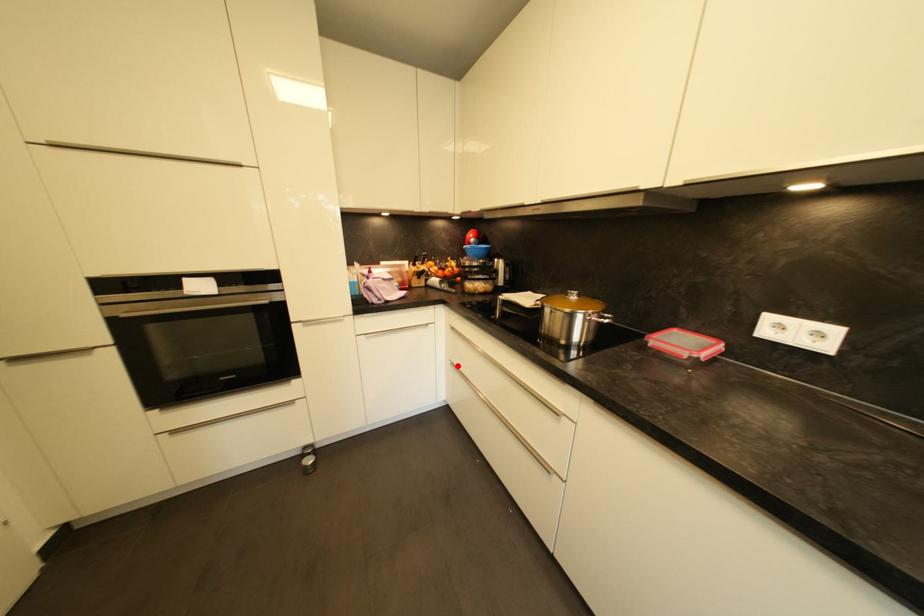
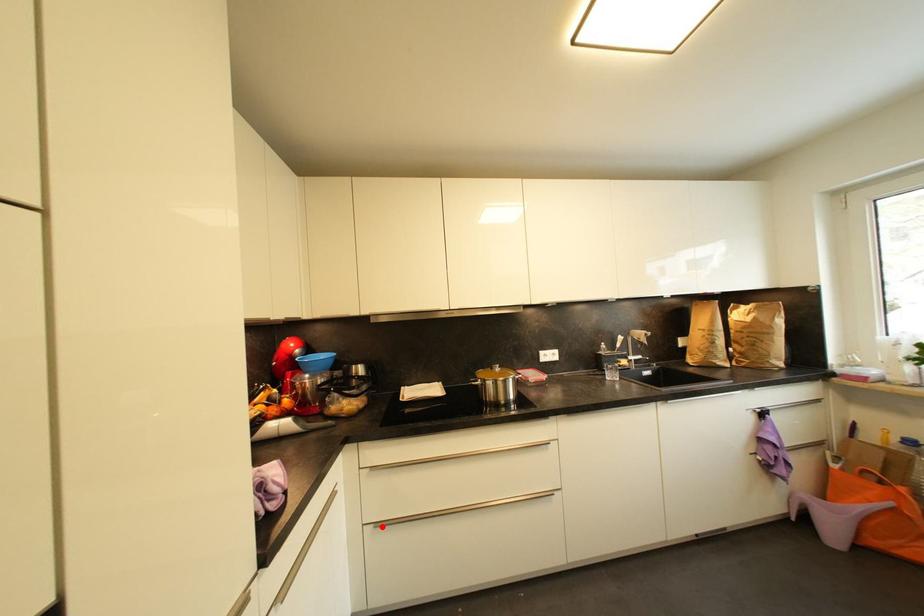
I am providing you with two images of the same scene from different viewpoints. A red point is marked on the first image and another point is marked on the second image. Is the red point in image1 aligned with the point shown in image2?

Yes